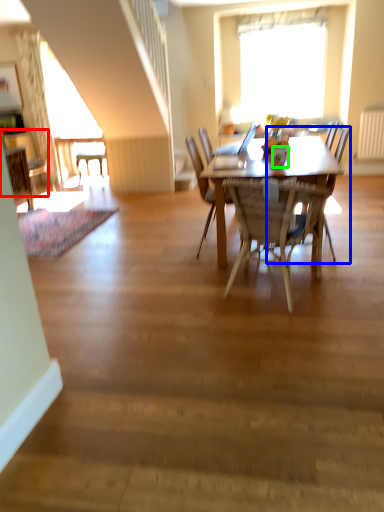
Question: Which object is the closest to the chair (highlighted by a red box)? Choose among these: chair (highlighted by a blue box) or vase (highlighted by a green box).

Choices:
 (A) chair
 (B) vase

Answer: (B)